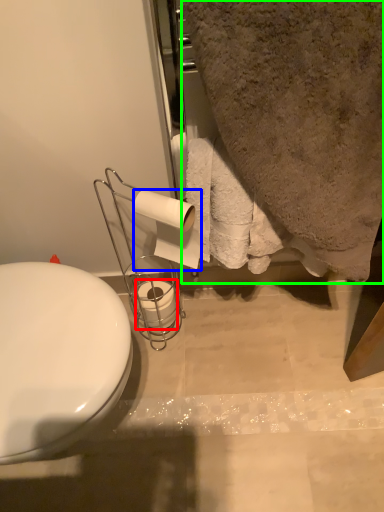
Question: Which is farther away from toilet paper (highlighted by a red box)? toilet paper (highlighted by a blue box) or bath towel (highlighted by a green box)?

Choices:
 (A) toilet paper
 (B) bath towel

Answer: (B)